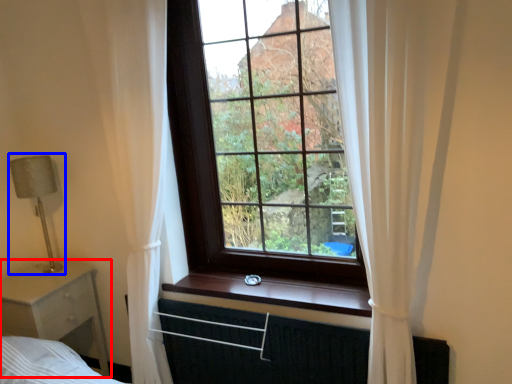
Question: Which object is closer to the camera taking this photo, nightstand (highlighted by a red box) or table lamp (highlighted by a blue box)?

Choices:
 (A) nightstand
 (B) table lamp

Answer: (A)